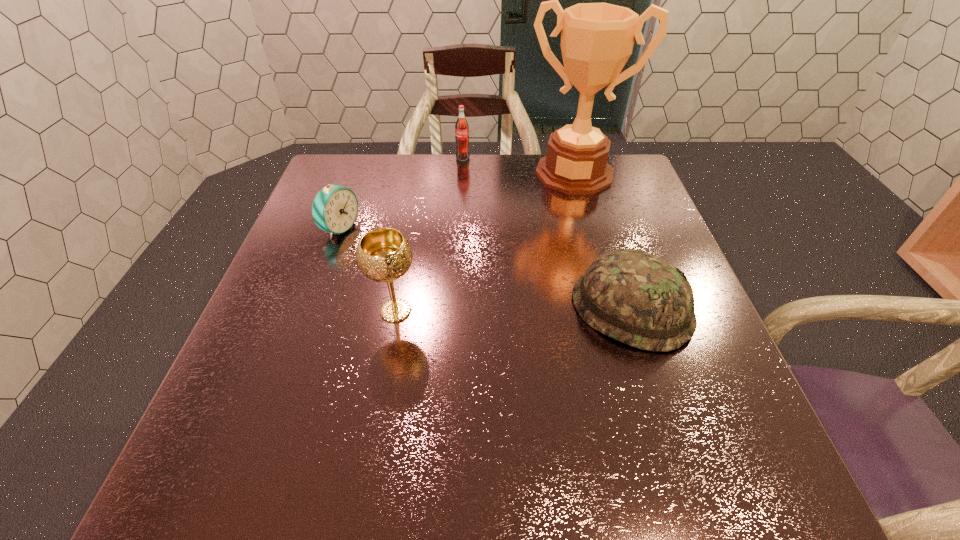
This screenshot has width=960, height=540. What are the coordinates of `vacant space on the desktop that is between the fourth object from right to left and the headwear and is positioned on the front-facing side of the third farthest object` in the screenshot? It's located at (536, 310).

You are a GUI agent. You are given a task and a screenshot of the screen. Output one action in this format:
    pyautogui.click(x=<x>, y=<y>)
    Task: Click on the vacant space on the desktop that is between the chalice and the headwear and is positioned on the front-facing side of the tallest object
    The image size is (960, 540).
    Given the screenshot: What is the action you would take?
    pyautogui.click(x=540, y=310)

What are the coordinates of `vacant spot on the desktop that is between the second object from left to right and the headwear and is positioned on the label of the third object from right to left` in the screenshot? It's located at (487, 310).